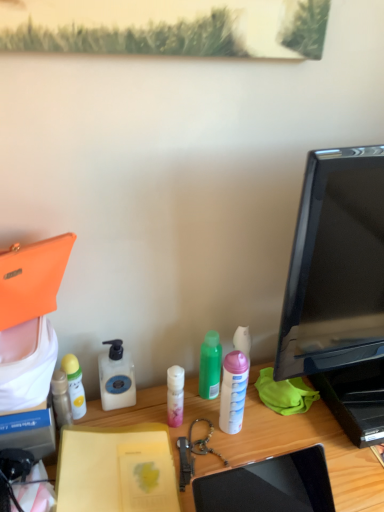
Question: Considering the relative sizes of black glossy monitor at right and yellow matte notebook at center in the image provided, is black glossy monitor at right smaller than yellow matte notebook at center?

Choices:
 (A) no
 (B) yes

Answer: (A)

Question: Is black glossy monitor at right taller than yellow matte notebook at center?

Choices:
 (A) yes
 (B) no

Answer: (A)

Question: Does black glossy monitor at right appear on the right side of yellow matte notebook at center?

Choices:
 (A) no
 (B) yes

Answer: (B)

Question: Can you confirm if black glossy monitor at right is bigger than yellow matte notebook at center?

Choices:
 (A) no
 (B) yes

Answer: (B)

Question: Is black glossy monitor at right surrounding yellow matte notebook at center?

Choices:
 (A) no
 (B) yes

Answer: (A)

Question: Is green matte bottle at center, placed as the fourth bottle when sorted from left to right, situated inside yellow matte notebook at center or outside?

Choices:
 (A) inside
 (B) outside

Answer: (B)

Question: In the image, is green matte bottle at center, which is the 2th bottle in right-to-left order, on the left side or the right side of yellow matte notebook at center?

Choices:
 (A) left
 (B) right

Answer: (B)

Question: Is green matte bottle at center, placed as the fourth bottle when sorted from left to right, bigger or smaller than yellow matte notebook at center?

Choices:
 (A) small
 (B) big

Answer: (A)

Question: Is point (215, 360) closer or farther from the camera than point (89, 472)?

Choices:
 (A) closer
 (B) farther

Answer: (B)

Question: From the image's perspective, is black glossy monitor at right positioned above or below wooden desk at center?

Choices:
 (A) below
 (B) above

Answer: (B)

Question: Relative to wooden desk at center, is black glossy monitor at right in front or behind?

Choices:
 (A) front
 (B) behind

Answer: (B)

Question: Looking at their shapes, would you say black glossy monitor at right is wider or thinner than wooden desk at center?

Choices:
 (A) wide
 (B) thin

Answer: (B)

Question: Would you say black glossy monitor at right is inside or outside wooden desk at center?

Choices:
 (A) outside
 (B) inside

Answer: (A)

Question: Visually, is wooden desk at center positioned to the left or to the right of yellow matte notebook at center?

Choices:
 (A) left
 (B) right

Answer: (B)

Question: In terms of width, does wooden desk at center look wider or thinner when compared to yellow matte notebook at center?

Choices:
 (A) wide
 (B) thin

Answer: (A)